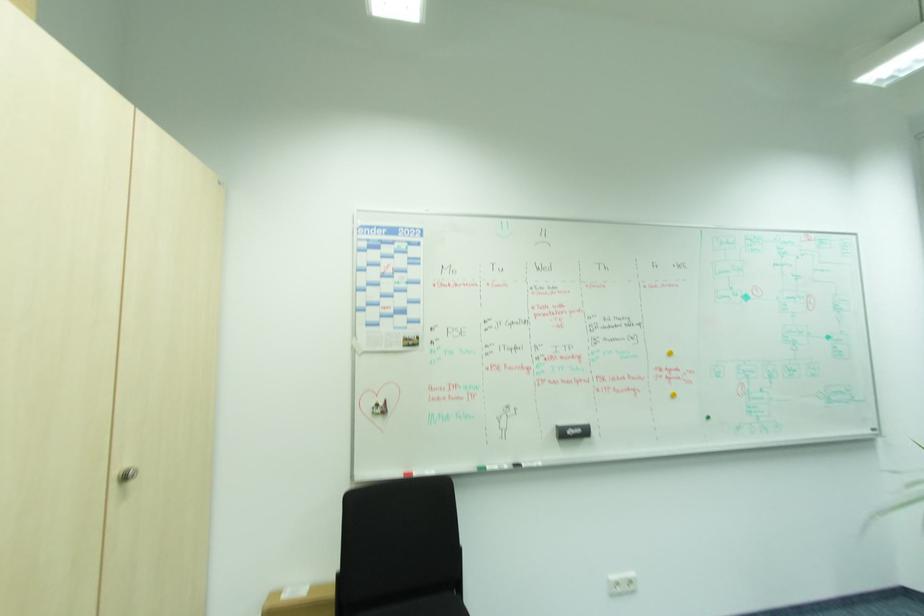
You are a GUI agent. You are given a task and a screenshot of the screen. Output one action in this format:
    pyautogui.click(x=<x>, y=<y>)
    Task: Click on the cardboard box
    
    Given the screenshot: What is the action you would take?
    pyautogui.click(x=300, y=601)